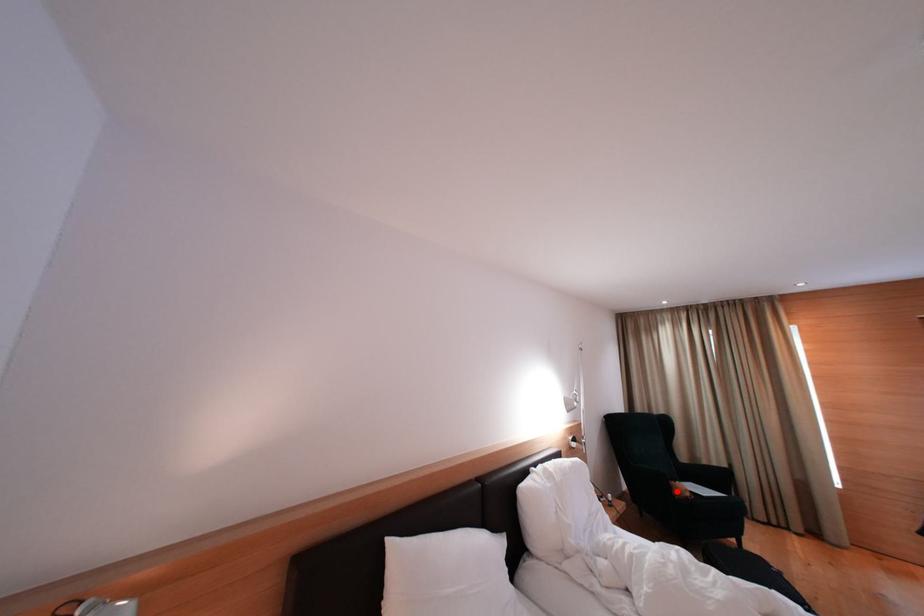
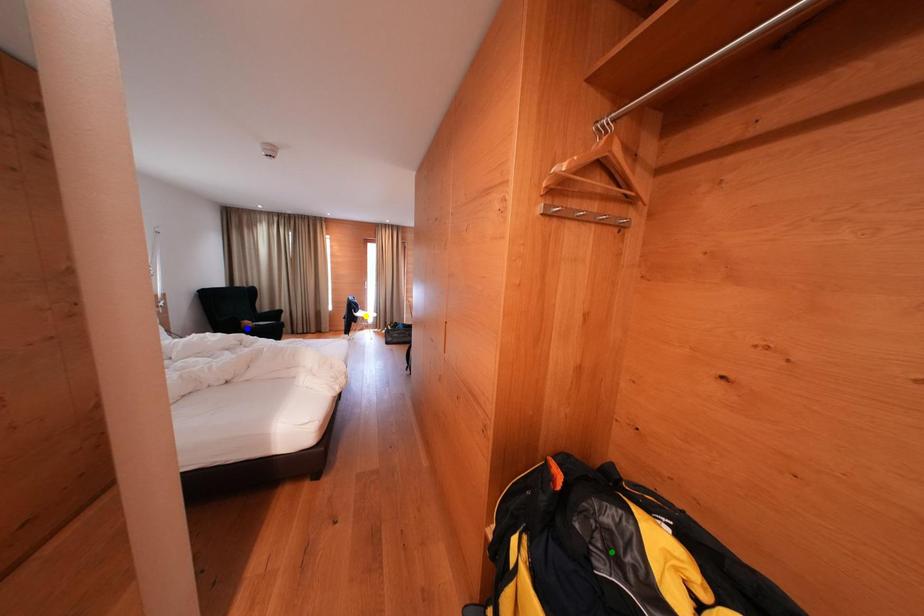
Question: I am providing you with two images of the same scene from different viewpoints. A red point is marked on the first image. You are given multiple points on the second image. Which point in image 2 represents the same 3d spot as the red point in image 1?

Choices:
 (A) yellow point
 (B) green point
 (C) blue point

Answer: (C)